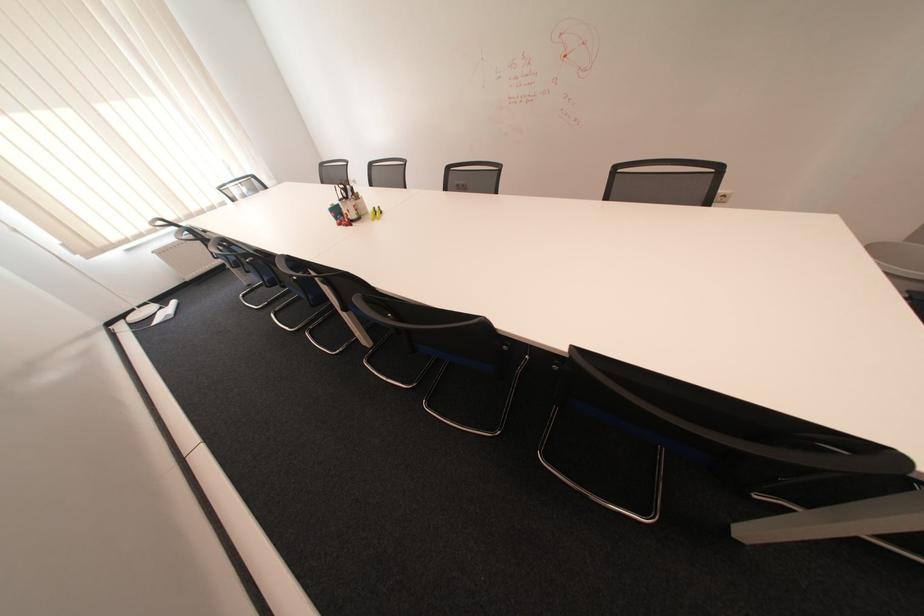
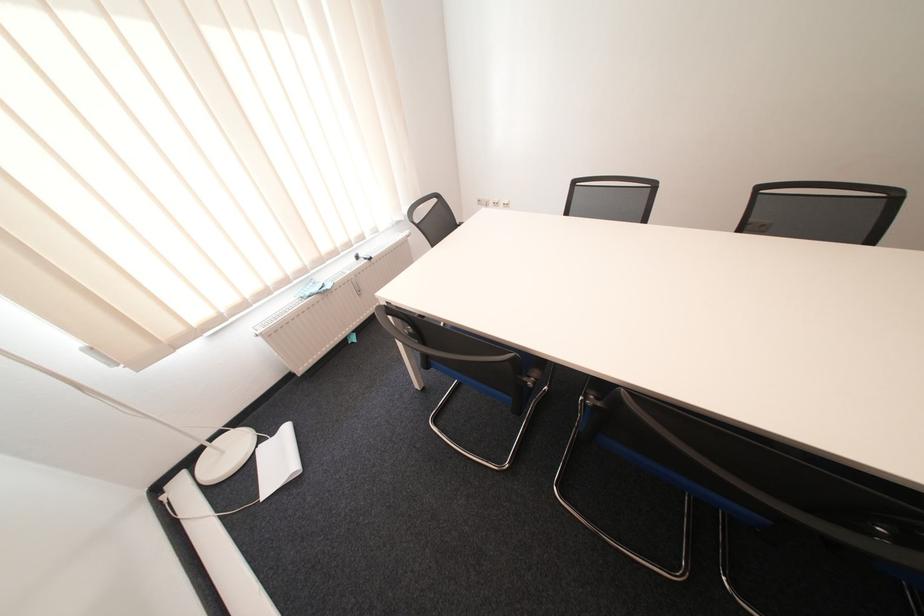
Locate, in the second image, the point that corresponds to point (151, 307) in the first image.

(225, 438)